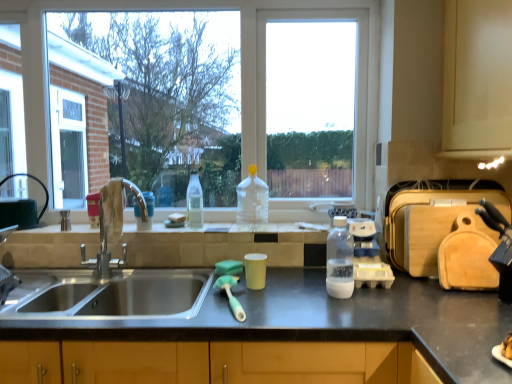
Question: Is clear plastic bottle at center, marked as the 3th bottle in a front-to-back arrangement, inside or outside of clear glass screen door at left?

Choices:
 (A) inside
 (B) outside

Answer: (B)

Question: In terms of size, does clear plastic bottle at center, which appears as the 3th bottle when viewed from the right, appear bigger or smaller than clear glass screen door at left?

Choices:
 (A) big
 (B) small

Answer: (B)

Question: Estimate the real-world distances between objects in this image. Which object is farther from the matte silver faucet at center?

Choices:
 (A) stainless steel sink at left
 (B) translucent plastic bottle at center, which is the 1th appliance in left-to-right order
 (C) transparent plastic bottle at center, which ranks as the third bottle in left-to-right order
 (D) white plastic cup at sink
 (E) clear plastic bottle at center, marked as the 3th bottle in a front-to-back arrangement

Answer: (B)

Question: Estimate the real-world distances between objects in this image. Which object is farther from the clear plastic bottle at center, marked as the 3th bottle in a front-to-back arrangement?

Choices:
 (A) matte silver faucet at center
 (B) stainless steel sink at left
 (C) black granite countertop at center
 (D) clear glass screen door at left
 (E) translucent plastic bottle at center, which is the 1th appliance in left-to-right order

Answer: (D)